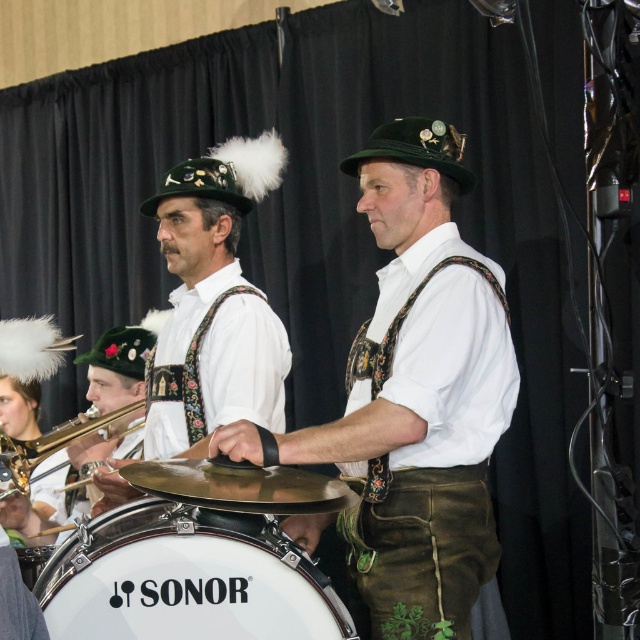
Between white matte drum at center and white leather drum at center, which one has more height?

white matte drum at center

Between white matte drum at center and white leather drum at center, which one appears on the left side from the viewer's perspective?

white leather drum at center is more to the left.

Identify the location of white matte drum at center. (186, 579).

Measure the distance between white matte drum at center and gold brass trumpet at lower left.

white matte drum at center is 19.00 inches away from gold brass trumpet at lower left.

Is white matte drum at center closer to the viewer compared to gold brass trumpet at lower left?

That is True.

Between point (52, 595) and point (64, 461), which one is positioned in front?

Point (52, 595) is more forward.

Identify the location of white matte drum at center. The image size is (640, 640). (186, 579).

Is green leather pants at center in front of white matte drum at center?

Yes.

Where is `green leather pants at center`? green leather pants at center is located at coordinates (413, 396).

Find the location of a particular element. This screenshot has height=640, width=640. green leather pants at center is located at coordinates (413, 396).